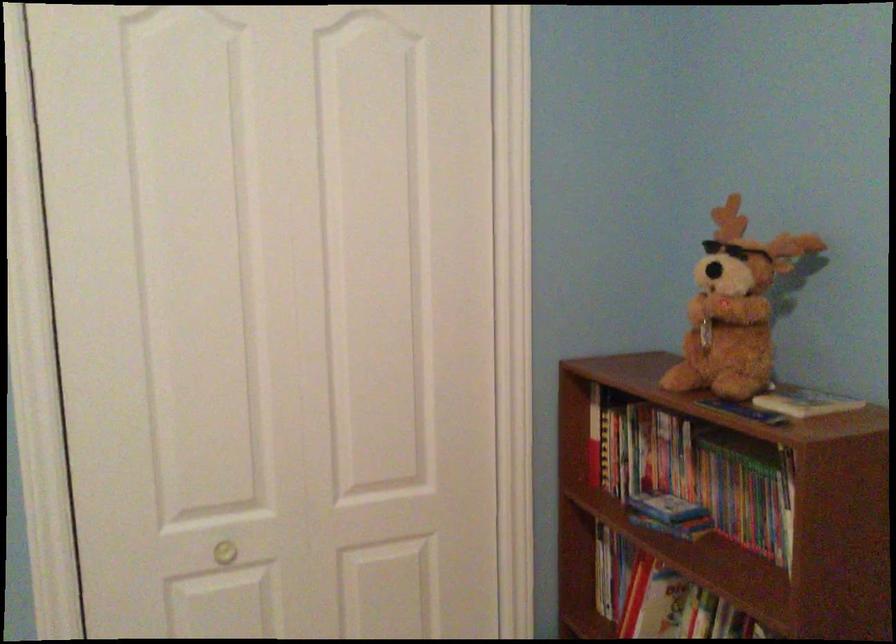
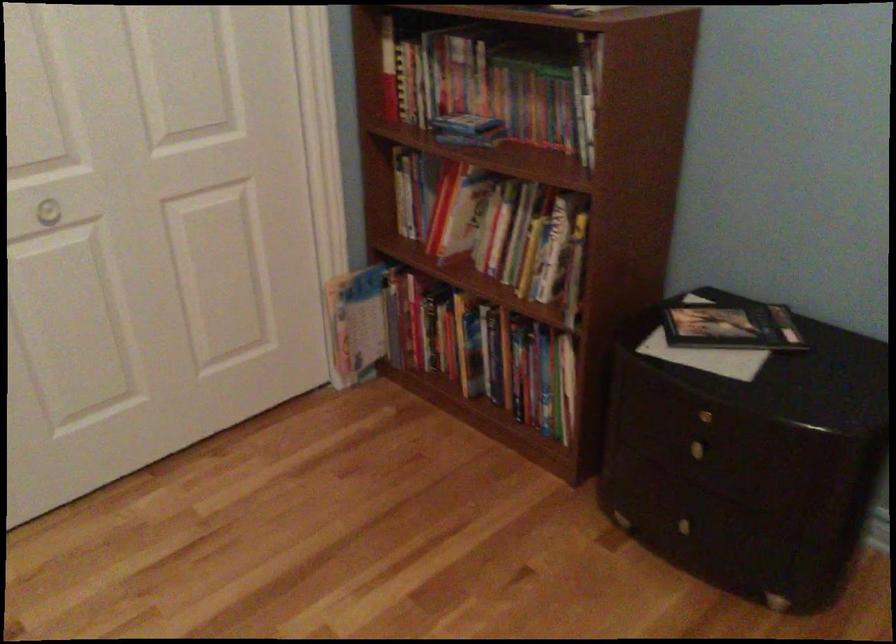
The point at (x=224, y=556) is marked in the first image. Where is the corresponding point in the second image?

(47, 212)